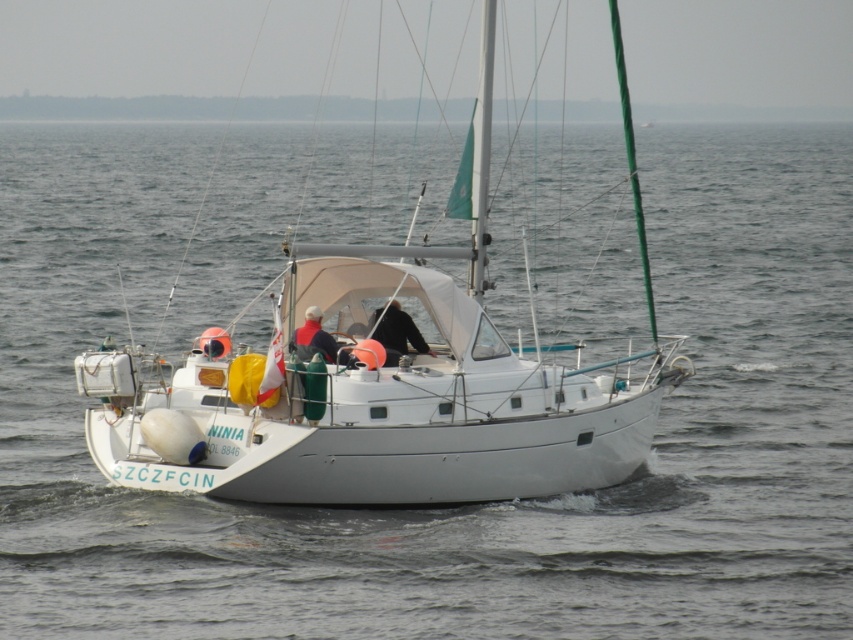
You are standing on the dock and see the white matte sailboat at center and the white matte jacket at center. Which object is positioned to the right side from your perspective?

The white matte sailboat at center is to the right of the white matte jacket at center.

You are a photographer on a nearby boat taking pictures of the scene. You notice the white matte sailboat at center and the white matte jacket at center. Which object should you focus on if you want to capture the taller object in the image?

The white matte sailboat at center is taller than the white matte jacket at center, so you should focus on the white matte sailboat at center to capture the taller object.